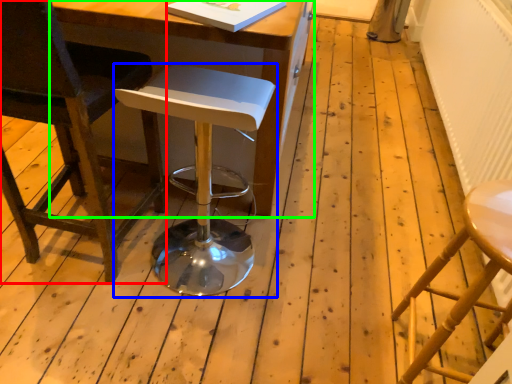
Question: Which object is the closest to the chair (highlighted by a red box)? Choose among these: stool (highlighted by a blue box) or table (highlighted by a green box).

Choices:
 (A) stool
 (B) table

Answer: (B)